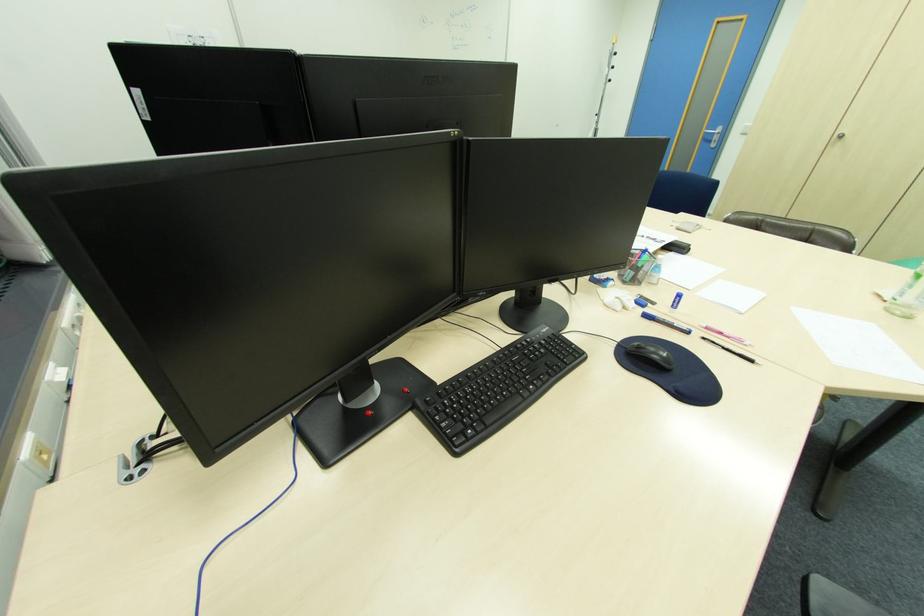
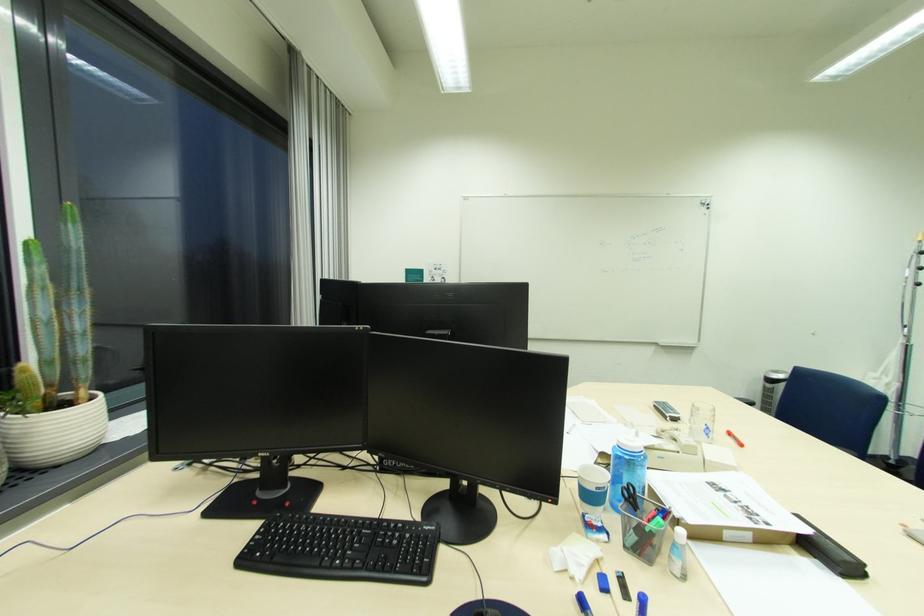
Where in the second image is the point corresponding to pixel 676 252 from the first image?

(821, 557)